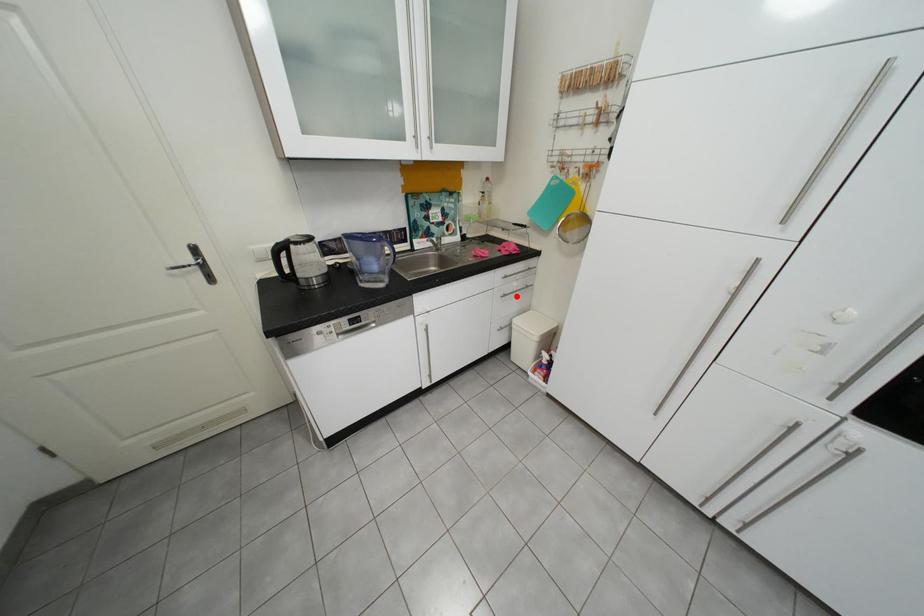
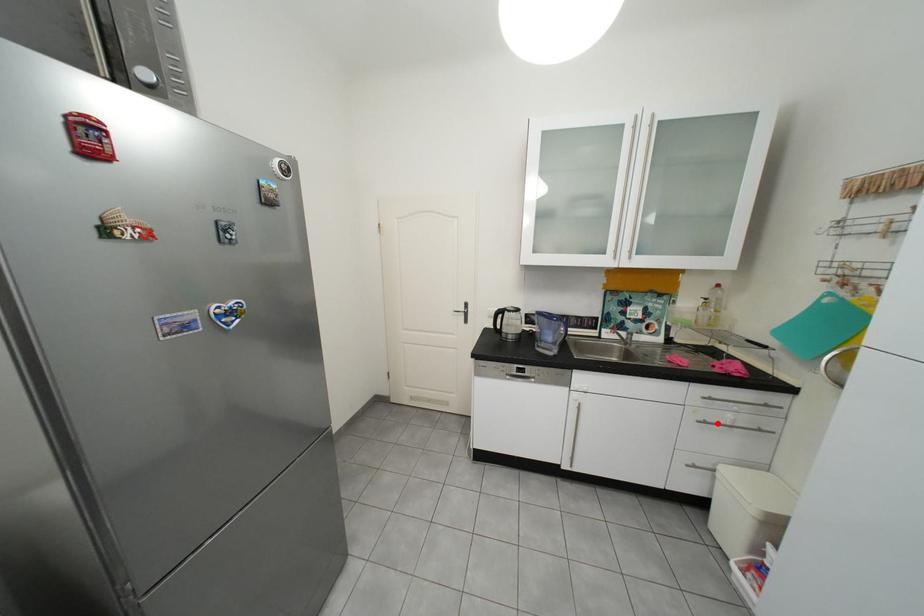
I am providing you with two images of the same scene from different viewpoints. A red point is marked on the first image and another point is marked on the second image. Is the marked point in image1 the same physical position as the marked point in image2?

Yes